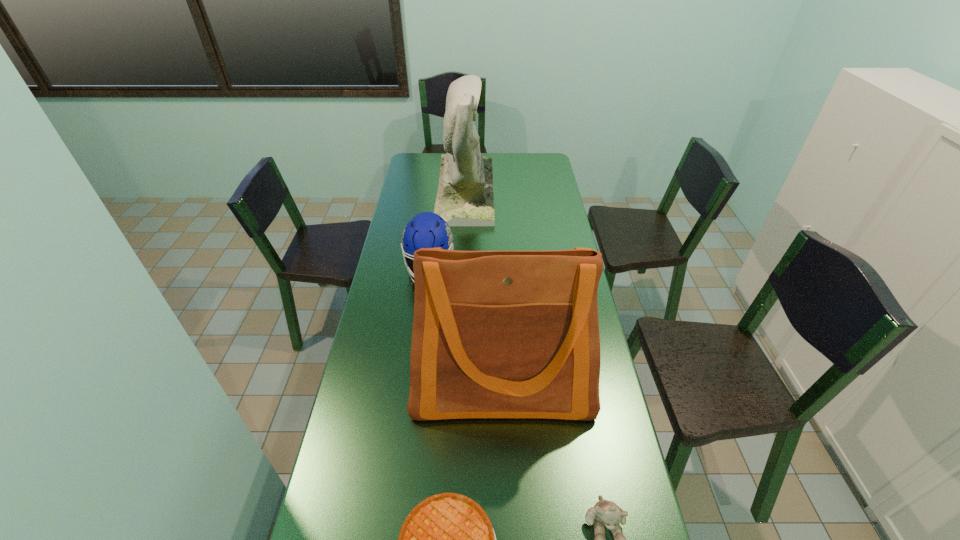
The image size is (960, 540). I want to click on free region at the far edge, so click(x=506, y=163).

Find the location of a particular element. vacant space at the left edge of the desktop is located at coordinates (395, 258).

The width and height of the screenshot is (960, 540). What are the coordinates of `free region at the right edge of the desktop` in the screenshot? It's located at (619, 485).

Identify the location of object that can be found as the second closest to the farthest object. (496, 334).

Choose which object is the third nearest neighbor to the second farthest object. Please provide its 2D coordinates. Your answer should be formatted as a tuple, i.e. [(x, y)], where the tuple contains the x and y coordinates of a point satisfying the conditions above.

[(447, 539)]

This screenshot has width=960, height=540. In order to click on vacant region that satisfies the following two spatial constraints: 1. on the base of the sculpture; 2. on the face guard of the second farthest object in this screenshot , I will do `click(462, 269)`.